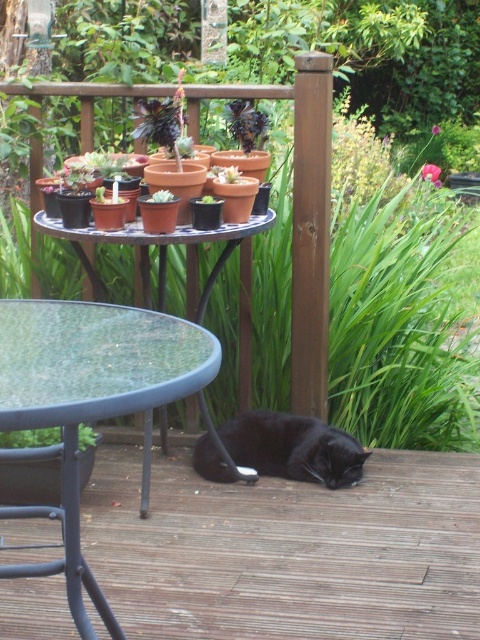
In the scene shown: Is glassy transparent table at center behind black matte cat at lower center?

That is False.

This screenshot has width=480, height=640. Describe the element at coordinates (166, 266) in the screenshot. I see `glassy transparent table at center` at that location.

The width and height of the screenshot is (480, 640). Find the location of `glassy transparent table at center`. glassy transparent table at center is located at coordinates (166, 266).

The height and width of the screenshot is (640, 480). What are the coordinates of `glassy transparent table at center` in the screenshot? It's located at (166, 266).

Who is higher up, transparent glass table at lower left or glassy transparent table at center?

glassy transparent table at center is above.

Between point (24, 403) and point (144, 260), which one is positioned in front?

Point (24, 403) is in front.

This screenshot has height=640, width=480. I want to click on transparent glass table at lower left, so click(x=91, y=401).

Can you confirm if brown wooden deck at center is bigger than transparent glass table at lower left?

Yes, brown wooden deck at center is bigger than transparent glass table at lower left.

Is brown wooden deck at center positioned before transparent glass table at lower left?

No.

Find the location of a particular element. This screenshot has width=480, height=640. brown wooden deck at center is located at coordinates coord(288,550).